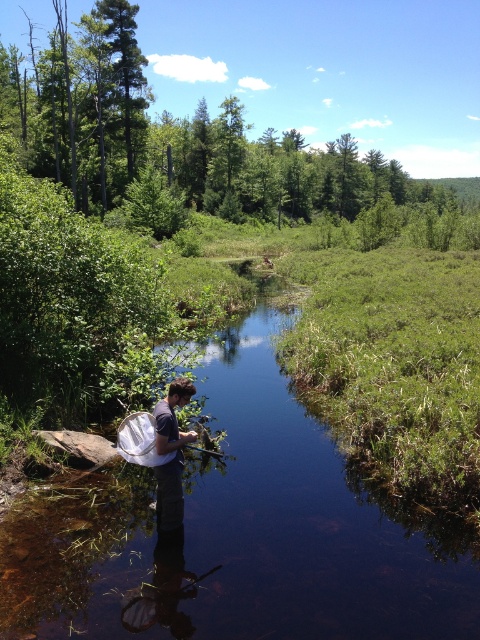
You are a photographer aiming to capture the reflection of the dark blue fabric shirt at center in the clear water at center. Based on the scene, will the reflection be visible?

The clear water at center is positioned under dark blue fabric shirt at center, so the reflection of the dark blue fabric shirt at center should be visible in the clear water at center since reflections are typically seen on the surface of water below the object.

You are standing at the edge of the stream and want to cross to the other side. The clear water at center is in your path. Can you step over it without getting your feet wet?

The clear water at center is located at point (236, 536), which indicates it is positioned centrally in the stream. Since the stream is narrow and calm, you can likely step over it without getting your feet wet by carefully placing your foot on the rocks or vegetation near the center.